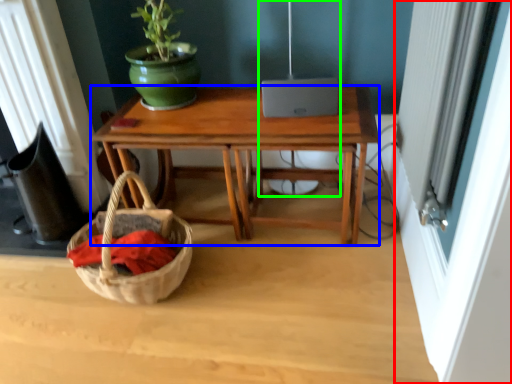
Question: Estimate the real-world distances between objects in this image. Which object is farther from screen door (highlighted by a red box), desk (highlighted by a blue box) or lamp (highlighted by a green box)?

Choices:
 (A) desk
 (B) lamp

Answer: (B)